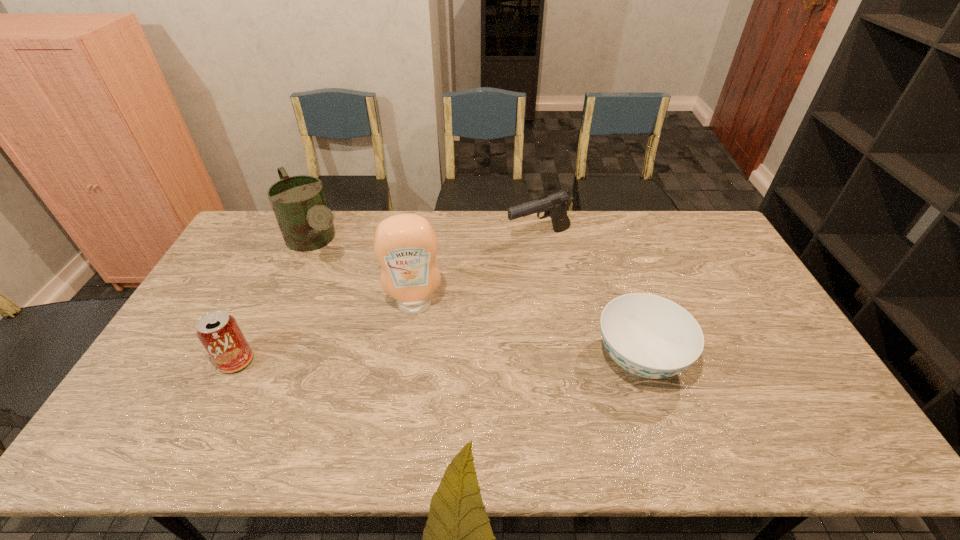
Where is `free space on the desktop that is between the soda can and the chinaware and is positioned with the spout on the fourth shortest object`? free space on the desktop that is between the soda can and the chinaware and is positioned with the spout on the fourth shortest object is located at coordinates (401, 360).

The image size is (960, 540). Find the location of `vacant space on the desktop that is between the soda can and the shortest object and is positioned at the muzzle of the gun`. vacant space on the desktop that is between the soda can and the shortest object and is positioned at the muzzle of the gun is located at coordinates (461, 360).

The height and width of the screenshot is (540, 960). What are the coordinates of `vacant space on the desktop that is between the soda can and the chinaware and is positioned on the label of the condiment` in the screenshot? It's located at (417, 360).